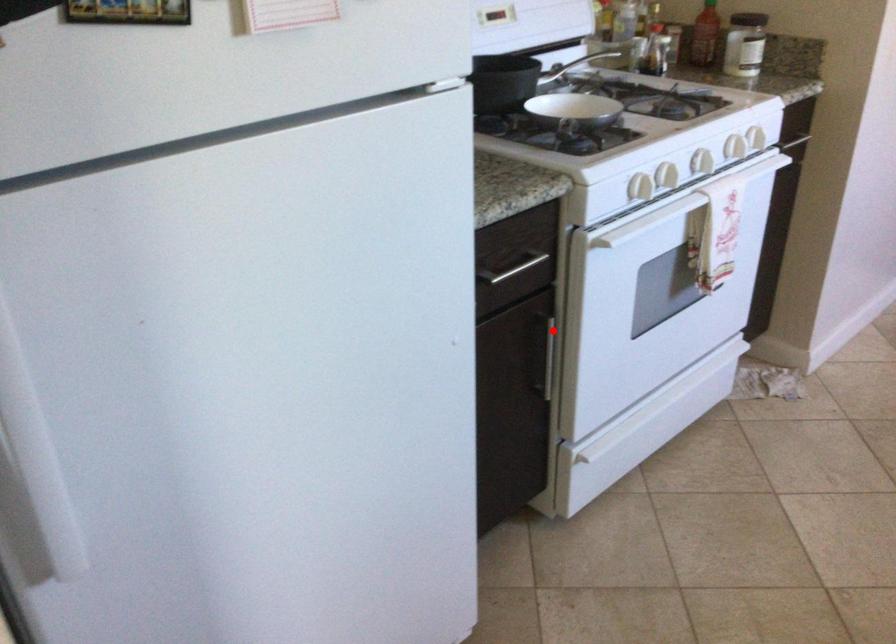
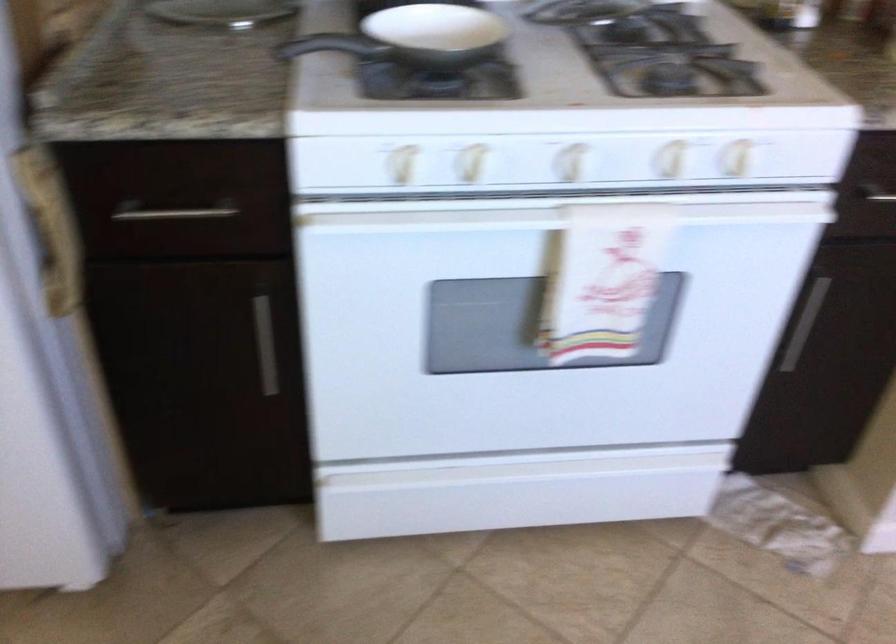
The point at the highlighted location is marked in the first image. Where is the corresponding point in the second image?

(264, 345)